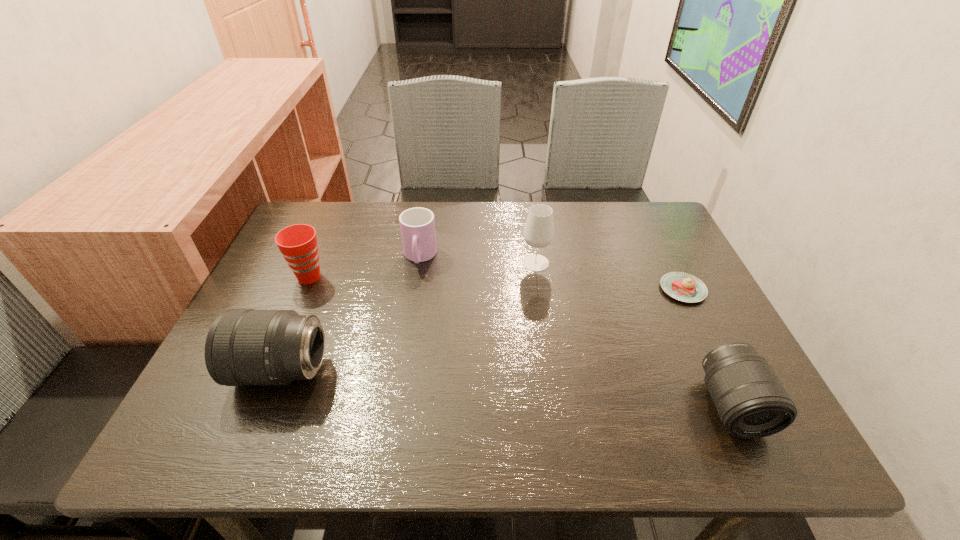
At what (x,y) coordinates should I click in order to perform the action: click on the second closest object relative to the shortest object. Please return your answer as a coordinate pair (x, y). The image size is (960, 540). Looking at the image, I should click on (539, 230).

Find the location of a particular element. The width and height of the screenshot is (960, 540). free spot that satisfies the following two spatial constraints: 1. on the front side of the left cup; 2. on the left side of the pastry is located at coordinates (304, 289).

The width and height of the screenshot is (960, 540). I want to click on vacant area in the image that satisfies the following two spatial constraints: 1. with the handle on the side of the third object from left to right; 2. on the surface of the taller telephoto lens, so click(401, 370).

Find the location of a particular element. free location that satisfies the following two spatial constraints: 1. on the front side of the fourth object from left to right; 2. on the surface of the taller telephoto lens is located at coordinates (551, 370).

Find the location of `vacant space that satisfies the following two spatial constraints: 1. with the handle on the side of the right cup; 2. on the surface of the left telephoto lens`. vacant space that satisfies the following two spatial constraints: 1. with the handle on the side of the right cup; 2. on the surface of the left telephoto lens is located at coordinates (401, 370).